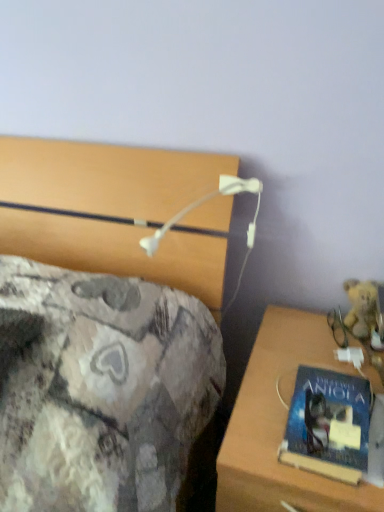
The width and height of the screenshot is (384, 512). In order to click on blue matte book at right in this screenshot , I will do `click(329, 425)`.

Find the location of a particular element. The width and height of the screenshot is (384, 512). wooden desk at lower right is located at coordinates (281, 425).

In order to click on blue matte book at right in this screenshot , I will do `click(329, 425)`.

From a real-world perspective, is fuzzy yellow teddy bear at right beneath blue matte book at right?

Actually, fuzzy yellow teddy bear at right is physically above blue matte book at right in the real world.

Does fuzzy yellow teddy bear at right appear on the right side of blue matte book at right?

Yes, fuzzy yellow teddy bear at right is to the right of blue matte book at right.

Is fuzzy yellow teddy bear at right not within blue matte book at right?

fuzzy yellow teddy bear at right lies outside blue matte book at right's area.

Consider the image. Considering the sizes of fuzzy yellow teddy bear at right and blue matte book at right in the image, is fuzzy yellow teddy bear at right bigger or smaller than blue matte book at right?

In the image, fuzzy yellow teddy bear at right appears to be smaller than blue matte book at right.

Is fuzzy yellow teddy bear at right facing away from wooden desk at lower right?

fuzzy yellow teddy bear at right does not have its back to wooden desk at lower right.

Does point (352, 285) lie behind point (253, 482)?

Yes, it is behind point (253, 482).

Consider the image. Which of these two, fuzzy yellow teddy bear at right or wooden desk at lower right, is smaller?

fuzzy yellow teddy bear at right is smaller.

Is wooden desk at lower right looking in the opposite direction of fuzzy yellow teddy bear at right?

No, wooden desk at lower right's orientation is not away from fuzzy yellow teddy bear at right.

From the image's perspective, is wooden desk at lower right over fuzzy yellow teddy bear at right?

Incorrect, from the image's perspective, wooden desk at lower right is lower than fuzzy yellow teddy bear at right.

Which object is positioned more to the right, wooden desk at lower right or fuzzy yellow teddy bear at right?

Positioned to the right is fuzzy yellow teddy bear at right.

How many degrees apart are the facing directions of wooden desk at lower right and fuzzy yellow teddy bear at right?

They differ by 0.00123 degrees in their facing directions.

Which is more to the right, blue matte book at right or wooden desk at lower right?

Positioned to the right is wooden desk at lower right.

Considering the relative sizes of blue matte book at right and wooden desk at lower right in the image provided, is blue matte book at right bigger than wooden desk at lower right?

No.

Would you say wooden desk at lower right is part of blue matte book at right's contents?

No, wooden desk at lower right is not a part of blue matte book at right.

From the image's perspective, who appears lower, blue matte book at right or wooden desk at lower right?

wooden desk at lower right.

Is blue matte book at right inside the boundaries of fuzzy yellow teddy bear at right, or outside?

blue matte book at right is outside fuzzy yellow teddy bear at right.

What's the angular difference between blue matte book at right and fuzzy yellow teddy bear at right's facing directions?

There is a 0.149-degree angle between the facing directions of blue matte book at right and fuzzy yellow teddy bear at right.

In the scene shown: Is blue matte book at right at the right side of fuzzy yellow teddy bear at right?

In fact, blue matte book at right is to the left of fuzzy yellow teddy bear at right.

From the image's perspective, is blue matte book at right positioned above or below fuzzy yellow teddy bear at right?

blue matte book at right is below fuzzy yellow teddy bear at right.

Is wooden desk at lower right far away from blue matte book at right?

wooden desk at lower right is actually quite close to blue matte book at right.

Can you confirm if wooden desk at lower right is positioned to the right of blue matte book at right?

Yes, wooden desk at lower right is to the right of blue matte book at right.

Is wooden desk at lower right looking in the opposite direction of blue matte book at right?

No, wooden desk at lower right is not facing the opposite direction of blue matte book at right.

Consider the image. Is wooden desk at lower right in front of blue matte book at right?

Yes.

Where is `book lying below the fuzzy yellow teddy bear at right (from the image's perspective)`? book lying below the fuzzy yellow teddy bear at right (from the image's perspective) is located at coordinates (329, 425).

In the image, there is a wooden desk at lower right. Where is `teddy bear above it (from the image's perspective)`? Image resolution: width=384 pixels, height=512 pixels. teddy bear above it (from the image's perspective) is located at coordinates (362, 307).

Considering their positions, is wooden desk at lower right positioned further to blue matte book at right than fuzzy yellow teddy bear at right?

fuzzy yellow teddy bear at right is further to blue matte book at right.

Estimate the real-world distances between objects in this image. Which object is closer to wooden desk at lower right, fuzzy yellow teddy bear at right or blue matte book at right?

Among the two, blue matte book at right is located nearer to wooden desk at lower right.

Which object lies nearer to the anchor point fuzzy yellow teddy bear at right, blue matte book at right or wooden desk at lower right?

wooden desk at lower right is closer to fuzzy yellow teddy bear at right.

Considering their positions, is wooden desk at lower right positioned closer to fuzzy yellow teddy bear at right than blue matte book at right?

Based on the image, wooden desk at lower right appears to be nearer to fuzzy yellow teddy bear at right.

Based on their spatial positions, is blue matte book at right or fuzzy yellow teddy bear at right closer to wooden desk at lower right?

blue matte book at right is positioned closer to the anchor wooden desk at lower right.

Considering their positions, is fuzzy yellow teddy bear at right positioned closer to blue matte book at right than wooden desk at lower right?

Among the two, wooden desk at lower right is located nearer to blue matte book at right.

At what (x,y) coordinates should I click in order to perform the action: click on book between fuzzy yellow teddy bear at right and wooden desk at lower right from top to bottom. Please return your answer as a coordinate pair (x, y). The width and height of the screenshot is (384, 512). Looking at the image, I should click on (329, 425).